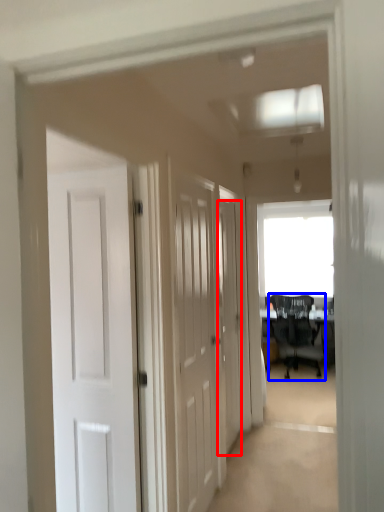
Question: Which object appears farthest to the camera in this image, door (highlighted by a red box) or chair (highlighted by a blue box)?

Choices:
 (A) door
 (B) chair

Answer: (B)